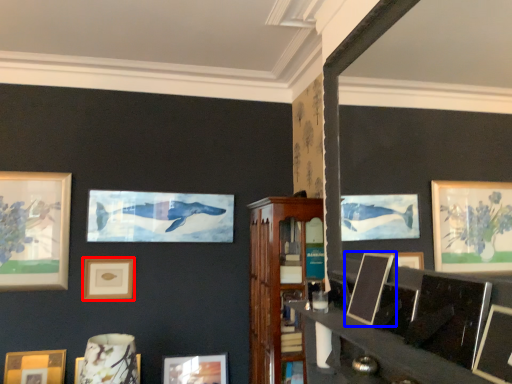
Question: Among these objects, which one is nearest to the camera, picture frame (highlighted by a red box) or picture frame (highlighted by a blue box)?

Choices:
 (A) picture frame
 (B) picture frame

Answer: (B)